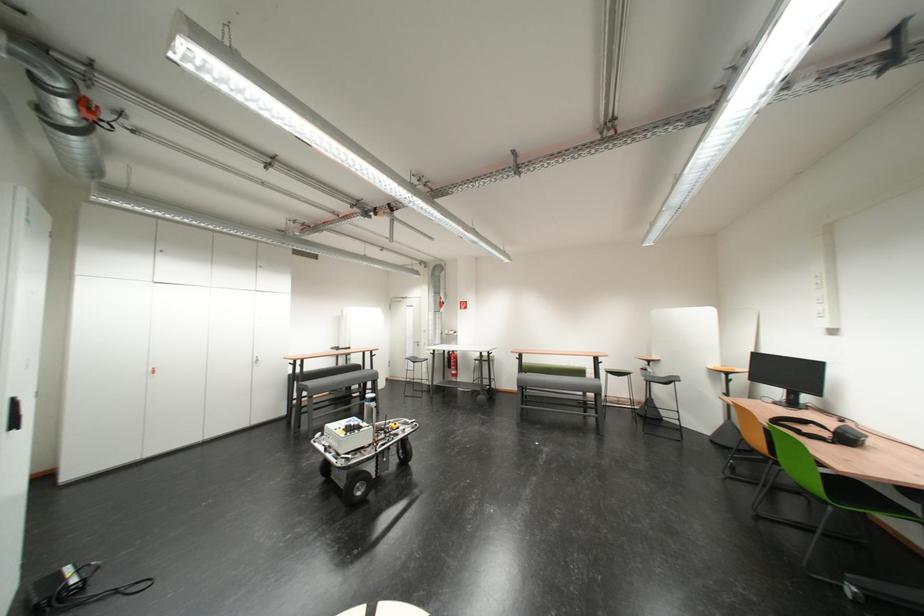
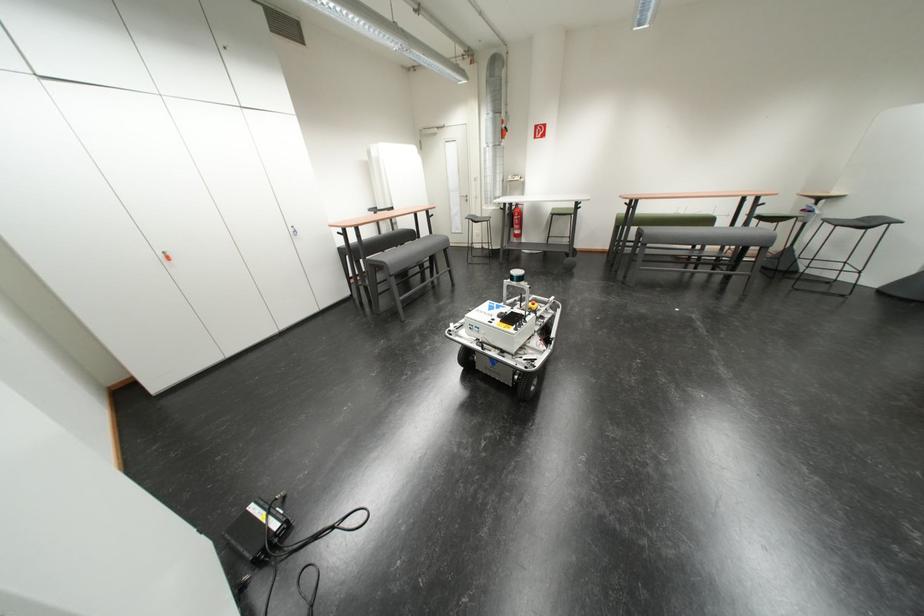
Find the pixel in the second image that matches (x=369, y=371) in the first image.

(423, 237)